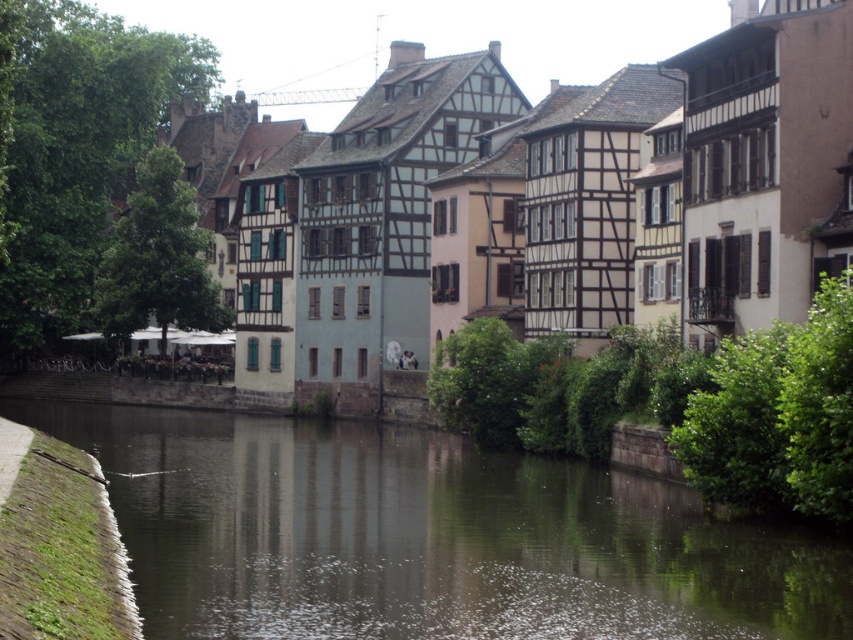
Does wooden houses at center have a greater width compared to green mossy stone at lower left?

Indeed, wooden houses at center has a greater width compared to green mossy stone at lower left.

Is point (758, 208) closer to viewer compared to point (12, 586)?

No, it is behind (12, 586).

Find the location of a particular element. The width and height of the screenshot is (853, 640). wooden houses at center is located at coordinates (741, 157).

Who is shorter, dark brown water at center or wooden houses at center?

dark brown water at center

At what (x,y) coordinates should I click in order to perform the action: click on dark brown water at center. Please return your answer as a coordinate pair (x, y). Looking at the image, I should click on (427, 536).

Find the location of a particular element. dark brown water at center is located at coordinates (427, 536).

Does dark brown water at center come in front of green mossy stone at lower left?

No, it is behind green mossy stone at lower left.

Between dark brown water at center and green mossy stone at lower left, which one has more height?

Standing taller between the two is green mossy stone at lower left.

Does point (177, 577) lie in front of point (80, 541)?

No, it is behind (80, 541).

I want to click on dark brown water at center, so click(x=427, y=536).